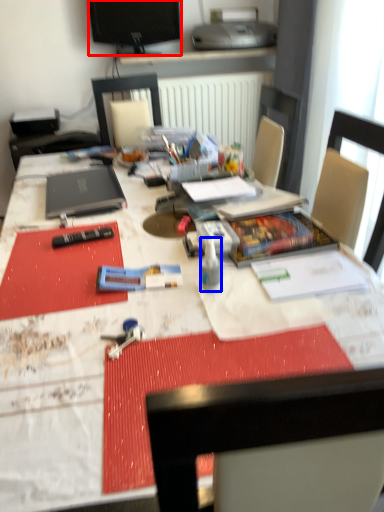
Question: Which point is closer to the camera, television (highlighted by a red box) or bottle (highlighted by a blue box)?

Choices:
 (A) television
 (B) bottle

Answer: (B)